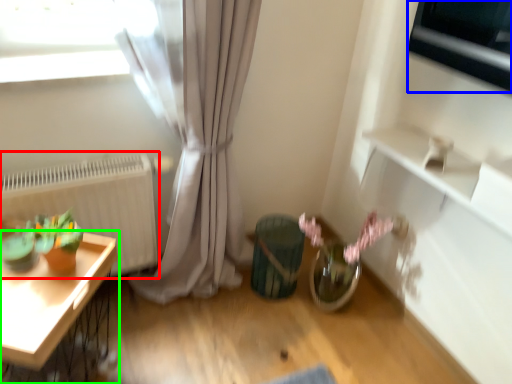
Question: Based on their relative distances, which object is farther from radiator (highlighted by a red box)? Choose from appliance (highlighted by a blue box) and table (highlighted by a green box).

Choices:
 (A) appliance
 (B) table

Answer: (A)